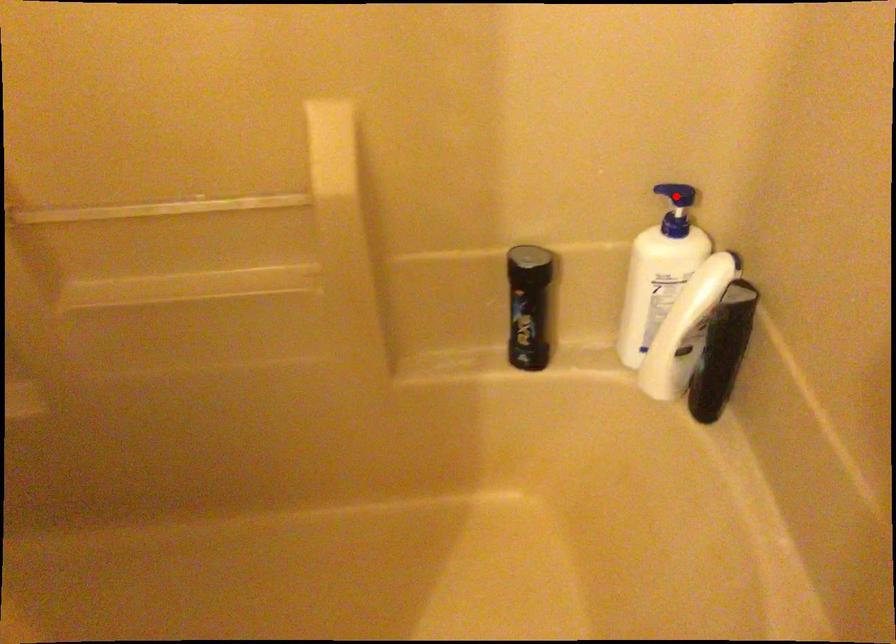
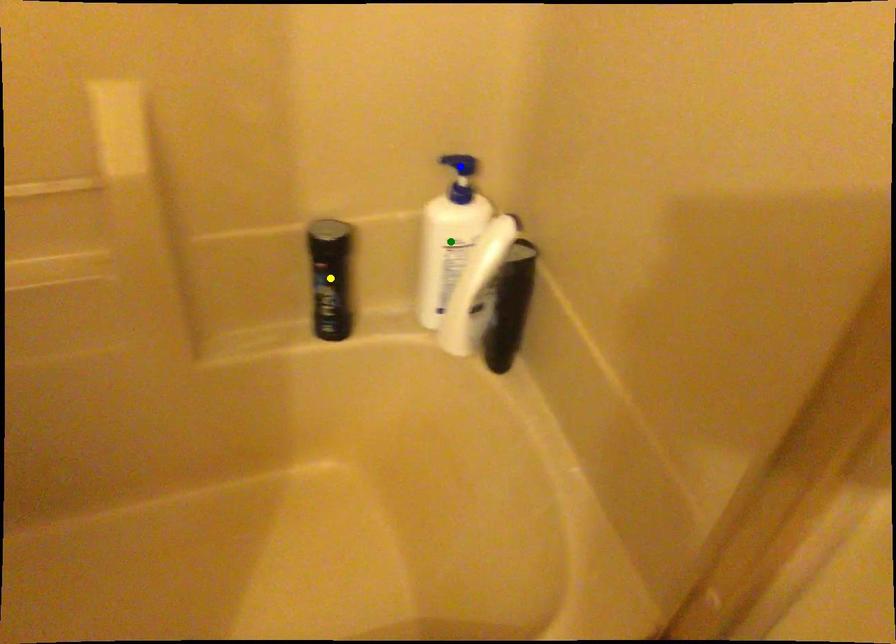
Question: I am providing you with two images of the same scene from different viewpoints. A red point is marked on the first image. You are given multiple points on the second image. Which point in image 2 represents the same 3d spot as the red point in image 1?

Choices:
 (A) blue point
 (B) yellow point
 (C) green point

Answer: (A)